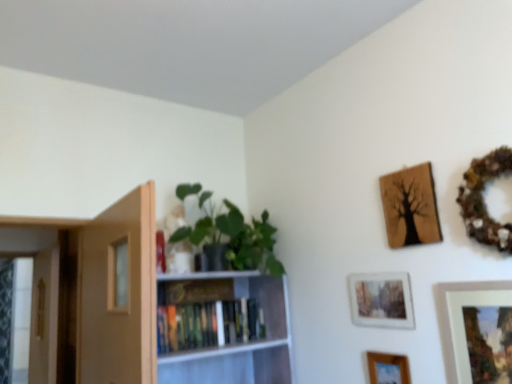
Question: Are wooden textured picture frame at upper right, positioned as the fourth picture frame in bottom-to-top order, and green matte plant at upper left located far from each other?

Choices:
 (A) yes
 (B) no

Answer: (B)

Question: From the image's perspective, is wooden textured picture frame at upper right, the 1th picture frame when ordered from top to bottom, on top of green matte plant at upper left?

Choices:
 (A) no
 (B) yes

Answer: (B)

Question: Is green matte plant at upper left at the back of wooden textured picture frame at upper right, positioned as the fourth picture frame in bottom-to-top order?

Choices:
 (A) yes
 (B) no

Answer: (B)

Question: Is wooden textured picture frame at upper right, the 1th picture frame when ordered from top to bottom, to the right of green matte plant at upper left from the viewer's perspective?

Choices:
 (A) no
 (B) yes

Answer: (B)

Question: Is wooden textured picture frame at upper right, positioned as the fourth picture frame in bottom-to-top order, aimed at green matte plant at upper left?

Choices:
 (A) yes
 (B) no

Answer: (B)

Question: Considering the relative sizes of wooden textured picture frame at upper right, the 1th picture frame when ordered from top to bottom, and green matte plant at upper left in the image provided, is wooden textured picture frame at upper right, the 1th picture frame when ordered from top to bottom, bigger than green matte plant at upper left?

Choices:
 (A) yes
 (B) no

Answer: (B)

Question: Is matte white picture frame at lower right, which is counted as the 3th picture frame, starting from the top, facing away from green matte plant at upper left?

Choices:
 (A) yes
 (B) no

Answer: (B)

Question: Considering the relative sizes of matte white picture frame at lower right, the 2th picture frame ordered from the bottom, and green matte plant at upper left in the image provided, is matte white picture frame at lower right, the 2th picture frame ordered from the bottom, shorter than green matte plant at upper left?

Choices:
 (A) no
 (B) yes

Answer: (B)

Question: Is matte white picture frame at lower right, which is counted as the 3th picture frame, starting from the top, smaller than green matte plant at upper left?

Choices:
 (A) no
 (B) yes

Answer: (B)

Question: Can you confirm if matte white picture frame at lower right, which is counted as the 3th picture frame, starting from the top, is thinner than green matte plant at upper left?

Choices:
 (A) yes
 (B) no

Answer: (A)

Question: From a real-world perspective, does matte white picture frame at lower right, the 2th picture frame ordered from the bottom, sit lower than green matte plant at upper left?

Choices:
 (A) yes
 (B) no

Answer: (A)

Question: Does matte white picture frame at lower right, the 2th picture frame ordered from the bottom, have a greater width compared to green matte plant at upper left?

Choices:
 (A) no
 (B) yes

Answer: (A)

Question: Is green matte plant at upper left turned away from wooden textured picture frame at upper right, the 1th picture frame when ordered from top to bottom?

Choices:
 (A) yes
 (B) no

Answer: (B)